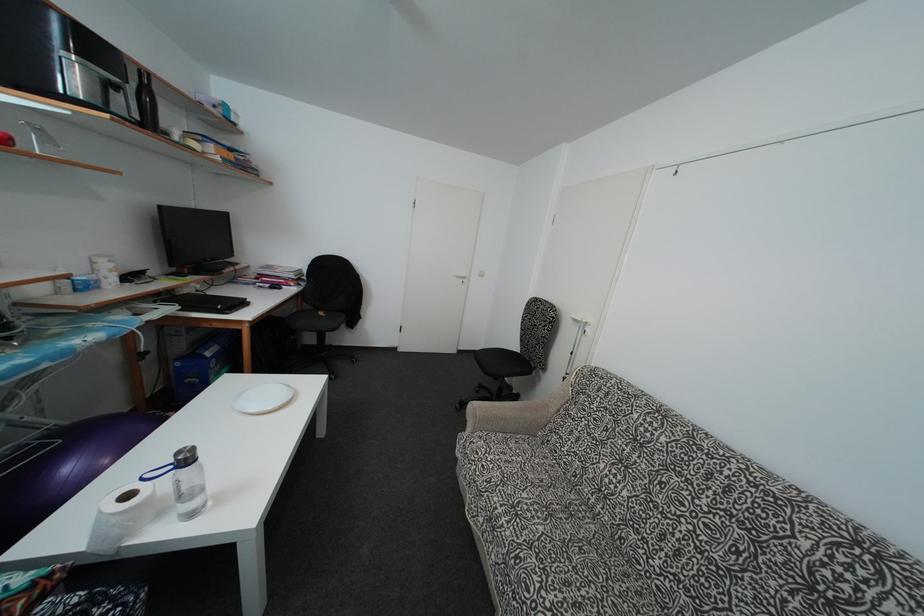
At what (x,y) coordinates should I click in order to perform the action: click on black bottle. Please return your answer as a coordinate pair (x, y). The image size is (924, 616). Looking at the image, I should click on (147, 102).